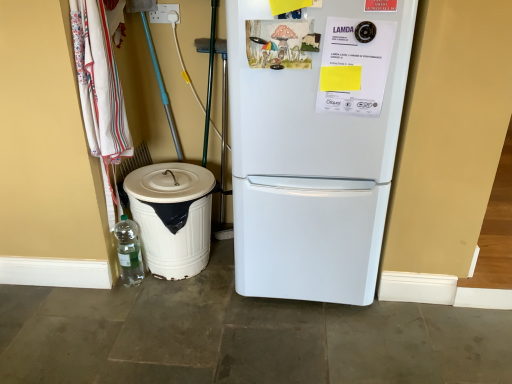
Question: Does white plastic trash can at lower left touch white fabric laundry at left?

Choices:
 (A) yes
 (B) no

Answer: (B)

Question: Does white plastic trash can at lower left have a lesser width compared to white fabric laundry at left?

Choices:
 (A) yes
 (B) no

Answer: (B)

Question: Is white plastic trash can at lower left wider than white fabric laundry at left?

Choices:
 (A) yes
 (B) no

Answer: (A)

Question: Does white plastic trash can at lower left appear on the right side of white fabric laundry at left?

Choices:
 (A) yes
 (B) no

Answer: (A)

Question: Is white plastic trash can at lower left closer to the viewer compared to white fabric laundry at left?

Choices:
 (A) no
 (B) yes

Answer: (A)

Question: Is white plastic electric outlet at upper center wider or thinner than white plastic trash can at lower left?

Choices:
 (A) wide
 (B) thin

Answer: (B)

Question: Relative to white plastic trash can at lower left, is white plastic electric outlet at upper center in front or behind?

Choices:
 (A) front
 (B) behind

Answer: (B)

Question: From their relative heights in the image, would you say white plastic electric outlet at upper center is taller or shorter than white plastic trash can at lower left?

Choices:
 (A) tall
 (B) short

Answer: (B)

Question: Is white plastic electric outlet at upper center bigger or smaller than white plastic trash can at lower left?

Choices:
 (A) big
 (B) small

Answer: (B)

Question: Is white fabric laundry at left situated inside clear plastic bottle at lower left or outside?

Choices:
 (A) outside
 (B) inside

Answer: (A)

Question: Looking at the image, does white fabric laundry at left seem bigger or smaller compared to clear plastic bottle at lower left?

Choices:
 (A) big
 (B) small

Answer: (A)

Question: Does point (83, 89) appear closer or farther from the camera than point (142, 273)?

Choices:
 (A) closer
 (B) farther

Answer: (A)

Question: From their relative heights in the image, would you say white fabric laundry at left is taller or shorter than clear plastic bottle at lower left?

Choices:
 (A) short
 (B) tall

Answer: (B)

Question: From the image's perspective, is white plastic electric outlet at upper center above or below white matte refrigerator at center?

Choices:
 (A) below
 (B) above

Answer: (B)

Question: Considering the positions of point (158, 11) and point (262, 236), is point (158, 11) closer or farther from the camera than point (262, 236)?

Choices:
 (A) farther
 (B) closer

Answer: (A)